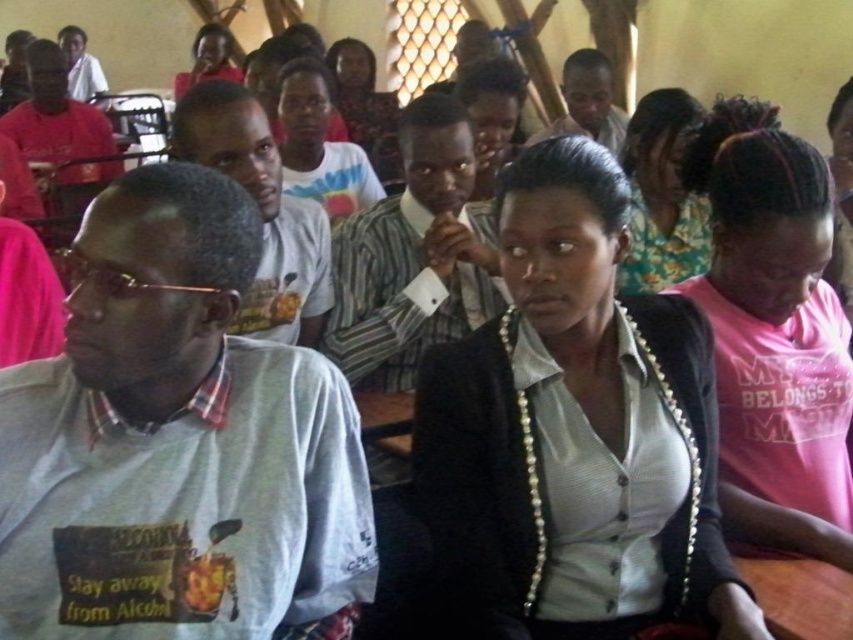
Question: Can you confirm if pink fabric shirt at right is positioned below matte white shirt at center?

Choices:
 (A) no
 (B) yes

Answer: (B)

Question: Can you confirm if gray fabric shirt at left is positioned to the right of black matte blazer at center?

Choices:
 (A) yes
 (B) no

Answer: (B)

Question: Which object is closer to the camera taking this photo?

Choices:
 (A) striped shirt at center
 (B) floral fabric dress at upper right
 (C) gray fabric shirt at left

Answer: (C)

Question: Which point is farther from the camera taking this photo?

Choices:
 (A) (608, 141)
 (B) (68, 77)

Answer: (B)

Question: Can you confirm if matte gray shirt at upper center is bigger than matte white shirt at upper left?

Choices:
 (A) no
 (B) yes

Answer: (A)

Question: Which of the following is the closest to the observer?

Choices:
 (A) floral fabric dress at upper right
 (B) matte pink shirt at upper left
 (C) pink fabric shirt at right
 (D) black matte blazer at center

Answer: (D)